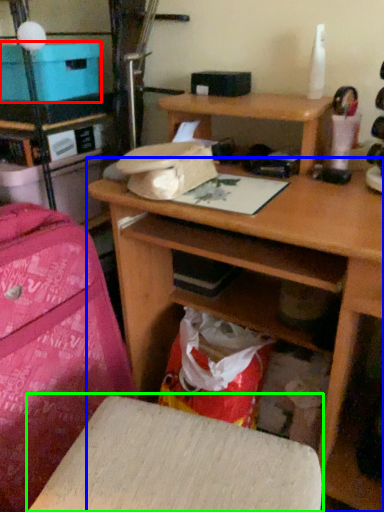
Question: Which is nearer to the cardboard box (highlighted by a red box)? desk (highlighted by a blue box) or furniture (highlighted by a green box).

Choices:
 (A) desk
 (B) furniture

Answer: (A)